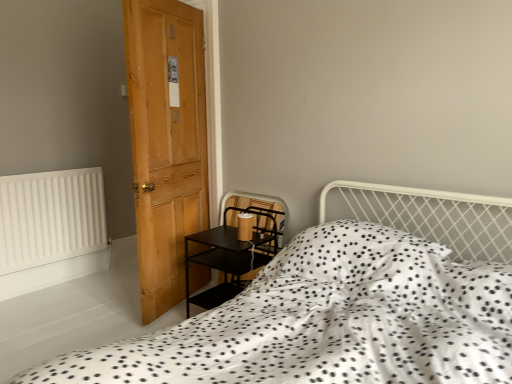
Question: Is white matte radiator at left closer to camera compared to light brown wooden door at left?

Choices:
 (A) no
 (B) yes

Answer: (A)

Question: Is white matte radiator at left facing towards light brown wooden door at left?

Choices:
 (A) no
 (B) yes

Answer: (B)

Question: Can you confirm if white matte radiator at left is smaller than light brown wooden door at left?

Choices:
 (A) no
 (B) yes

Answer: (B)

Question: Is white matte radiator at left not near light brown wooden door at left?

Choices:
 (A) yes
 (B) no

Answer: (A)

Question: Is white matte radiator at left shorter than light brown wooden door at left?

Choices:
 (A) no
 (B) yes

Answer: (B)

Question: Is the surface of white matte radiator at left in direct contact with light brown wooden door at left?

Choices:
 (A) no
 (B) yes

Answer: (A)

Question: From the image's perspective, is black matte side table at lower left below white matte radiator at left?

Choices:
 (A) yes
 (B) no

Answer: (A)

Question: Considering the relative positions of black matte side table at lower left and white matte radiator at left in the image provided, is black matte side table at lower left behind white matte radiator at left?

Choices:
 (A) yes
 (B) no

Answer: (B)

Question: Can you confirm if black matte side table at lower left is shorter than white matte radiator at left?

Choices:
 (A) yes
 (B) no

Answer: (A)

Question: Is black matte side table at lower left not close to white matte radiator at left?

Choices:
 (A) no
 (B) yes

Answer: (B)

Question: Is black matte side table at lower left outside white matte radiator at left?

Choices:
 (A) yes
 (B) no

Answer: (A)

Question: Is black matte side table at lower left facing towards white matte radiator at left?

Choices:
 (A) yes
 (B) no

Answer: (B)

Question: Is white matte radiator at left smaller than white dotted fabric at center?

Choices:
 (A) no
 (B) yes

Answer: (B)